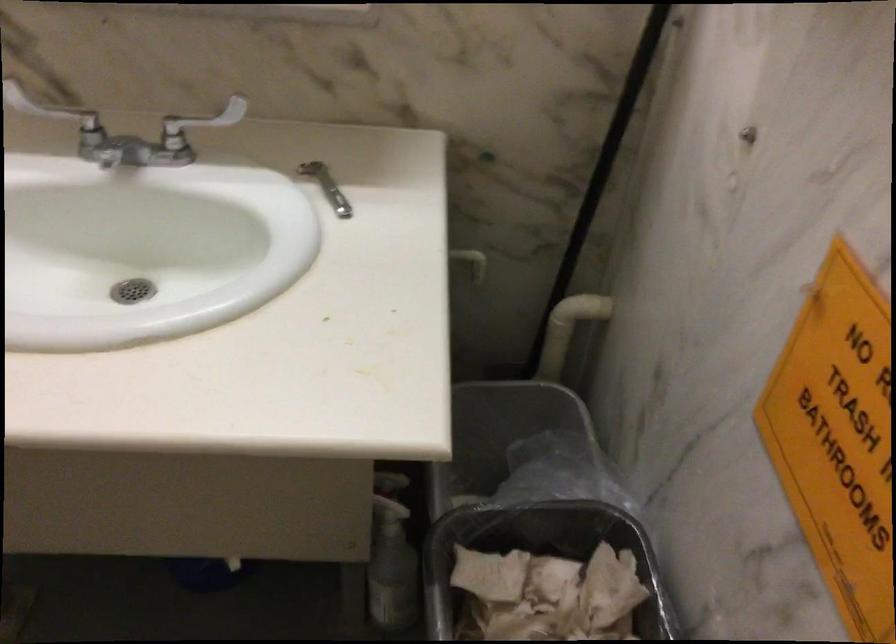
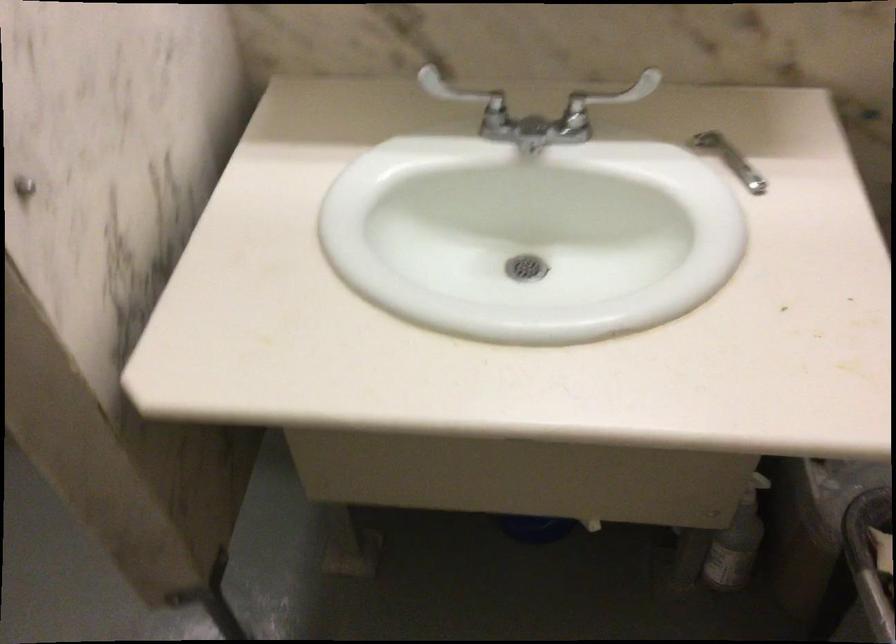
The point at (88, 125) is marked in the first image. Where is the corresponding point in the second image?

(464, 96)